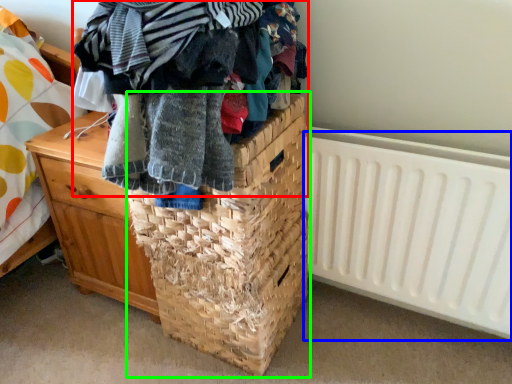
Question: Which is farther away from clothing (highlighted by a red box)? radiator (highlighted by a blue box) or basket (highlighted by a green box)?

Choices:
 (A) radiator
 (B) basket

Answer: (A)